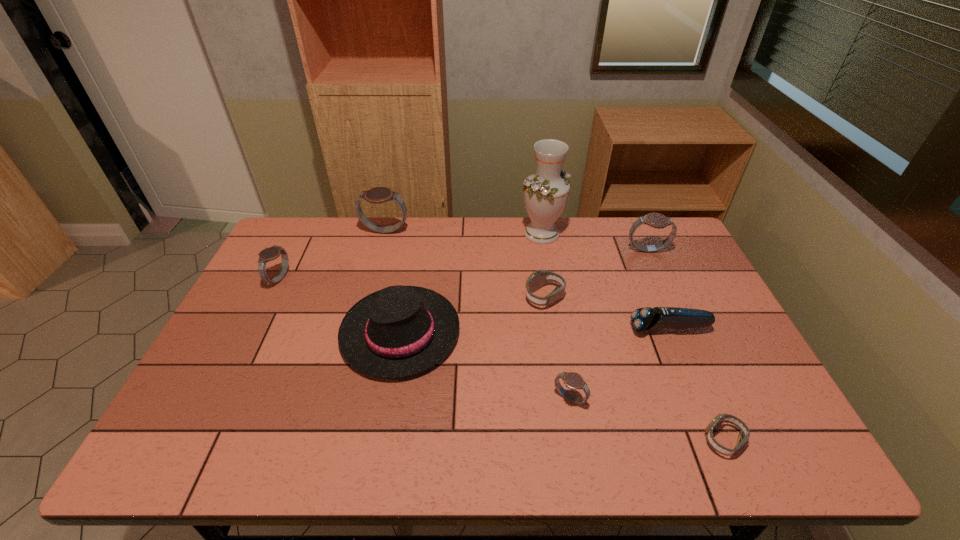
I want to click on gray watch object that ranks as the fourth closest to the bigger white watch, so click(243, 412).

Find the location of `gray watch that is the second closest to the farthest watch`. gray watch that is the second closest to the farthest watch is located at coordinates (243, 412).